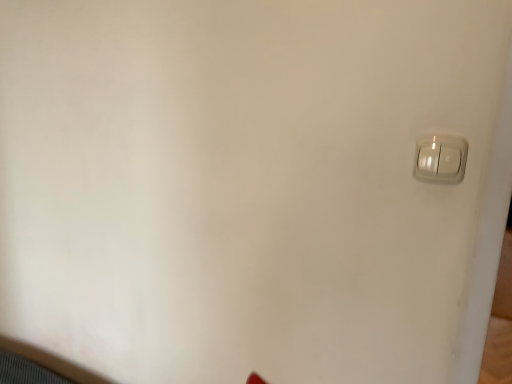
Measure the distance between point (x=455, y=141) and camera.

They are 27.48 inches apart.

What do you see at coordinates (440, 159) in the screenshot? I see `white glossy door handle at upper right` at bounding box center [440, 159].

Image resolution: width=512 pixels, height=384 pixels. I want to click on white glossy door handle at upper right, so click(440, 159).

Locate an element on the screen. This screenshot has width=512, height=384. white glossy door handle at upper right is located at coordinates (440, 159).